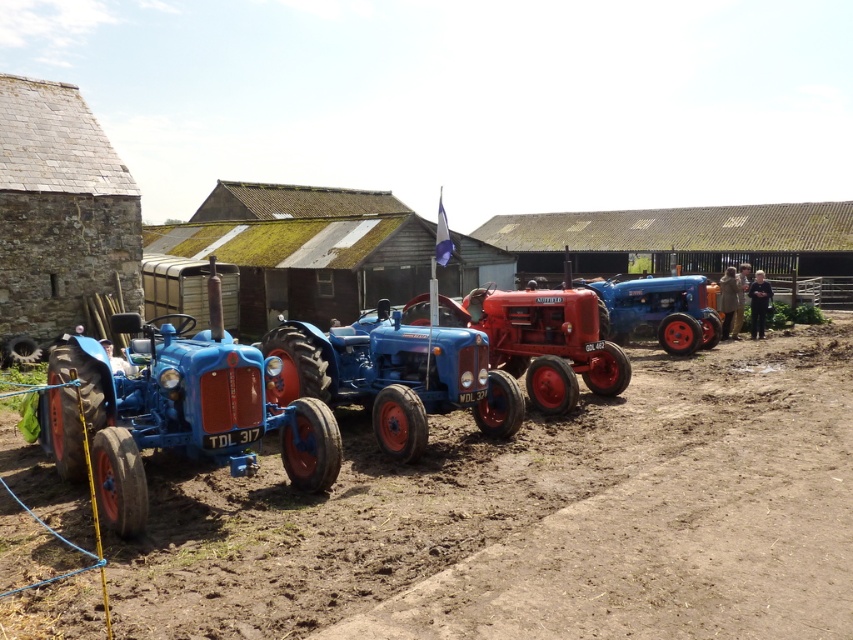
Question: Does brown soil at lower center appear over red matte tractor at center?

Choices:
 (A) no
 (B) yes

Answer: (A)

Question: Which object is positioned farthest from the brown soil at lower center?

Choices:
 (A) matte blue tractor at left
 (B) red matte tractor at center

Answer: (B)

Question: Based on their relative distances, which object is nearer to the brown soil at lower center?

Choices:
 (A) matte blue tractor at left
 (B) red matte tractor at center
 (C) matte blue tractor at center

Answer: (C)

Question: Estimate the real-world distances between objects in this image. Which object is closer to the red matte tractor at center?

Choices:
 (A) brown soil at lower center
 (B) matte blue tractor at left

Answer: (A)

Question: Does brown soil at lower center have a smaller size compared to matte blue tractor at center?

Choices:
 (A) no
 (B) yes

Answer: (A)

Question: Is brown soil at lower center thinner than matte blue tractor at center?

Choices:
 (A) yes
 (B) no

Answer: (B)